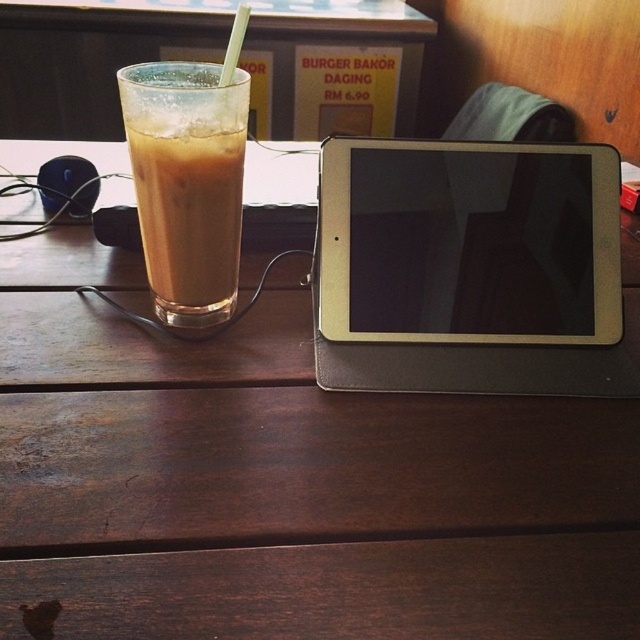
Please identify the object located at the coordinates point (468, 241) in the scene described. The scene includes a wooden table with a glass of iced coffee on the left side and a tablet device on the right. Your answer should reference the exact object label from the provided objects.

The point (468, 241) marks the silver metallic tablet at center.

You are a delivery person standing at the entrance of the room. You need to place a package that is 16 inches long on the table without moving any items. Is there enough space between the silver metallic tablet at center and the edge of the table to fit the package?

The silver metallic tablet at center is 15.66 inches from camera. Since the package is 16 inches long, it is slightly longer than the available space, so it might not fit without moving the tablet or other items.

You are a barista who needs to place a 5 inch wide coaster between the silver metallic tablet at center and the translucent glass cup at left. Is there enough space to do so?

The silver metallic tablet at center is 4.48 inches from the translucent glass cup at left. Since the coaster is 5 inches wide, there isn not enough space to place it between them.